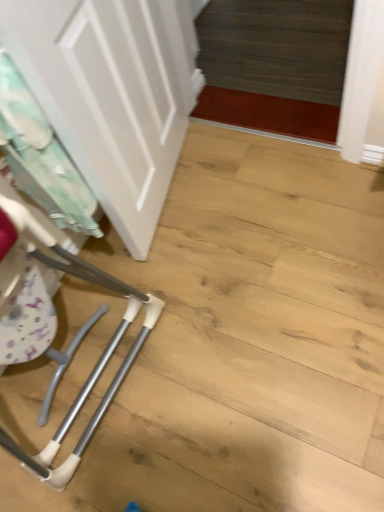
Question: Can you confirm if white matte door at upper left is wider than white fabric laundry at left?

Choices:
 (A) yes
 (B) no

Answer: (A)

Question: From the image's perspective, is white matte door at upper left beneath white fabric laundry at left?

Choices:
 (A) no
 (B) yes

Answer: (A)

Question: Does white matte door at upper left have a greater height compared to white fabric laundry at left?

Choices:
 (A) yes
 (B) no

Answer: (A)

Question: From a real-world perspective, is white matte door at upper left physically above white fabric laundry at left?

Choices:
 (A) no
 (B) yes

Answer: (B)

Question: Considering the relative sizes of white matte door at upper left and white fabric laundry at left in the image provided, is white matte door at upper left bigger than white fabric laundry at left?

Choices:
 (A) yes
 (B) no

Answer: (A)

Question: Is white matte door at upper left positioned beyond the bounds of white fabric laundry at left?

Choices:
 (A) yes
 (B) no

Answer: (A)

Question: From a real-world perspective, is white fabric laundry at left located beneath white matte door at upper left?

Choices:
 (A) yes
 (B) no

Answer: (A)

Question: From the image's perspective, is white fabric laundry at left below white matte door at upper left?

Choices:
 (A) yes
 (B) no

Answer: (A)

Question: Is white fabric laundry at left further to the viewer compared to white matte door at upper left?

Choices:
 (A) yes
 (B) no

Answer: (A)

Question: Can you confirm if white fabric laundry at left is thinner than white matte door at upper left?

Choices:
 (A) no
 (B) yes

Answer: (B)

Question: Can you confirm if white fabric laundry at left is smaller than white matte door at upper left?

Choices:
 (A) no
 (B) yes

Answer: (B)

Question: Can you confirm if white fabric laundry at left is wider than white matte door at upper left?

Choices:
 (A) yes
 (B) no

Answer: (B)

Question: Considering their positions, is white fabric laundry at left located in front of or behind white matte door at upper left?

Choices:
 (A) behind
 (B) front

Answer: (A)